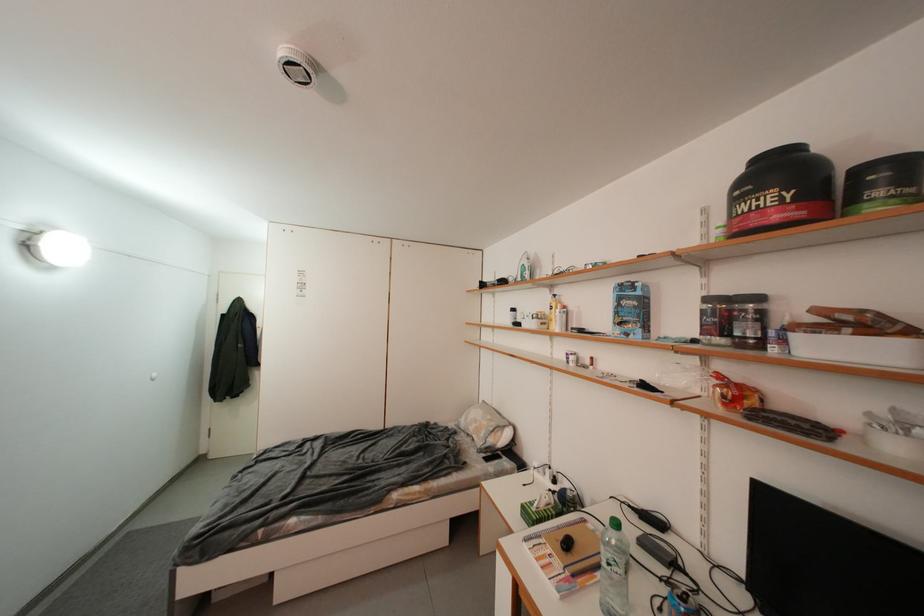
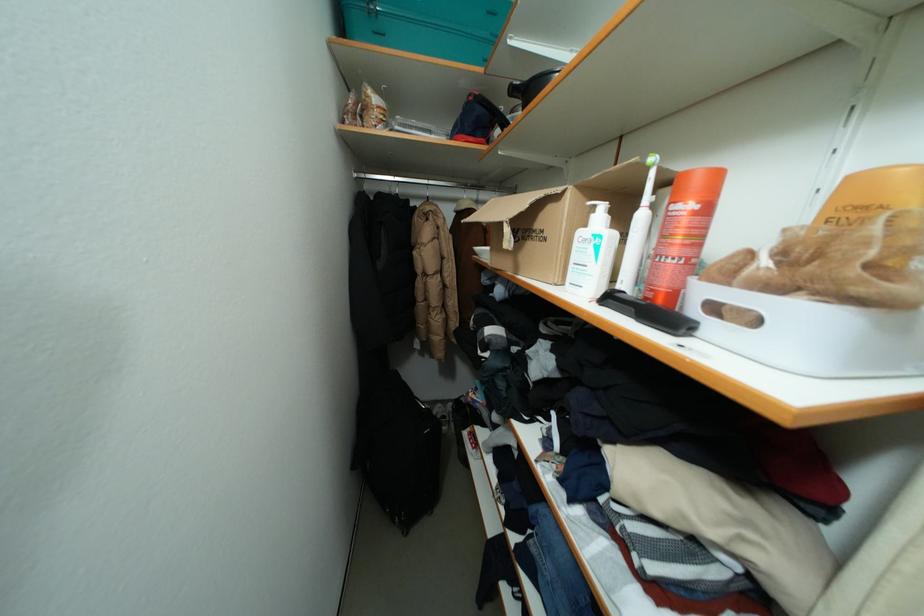
Question: I am providing you with two images of the same scene from different viewpoints. Please identify which objects are invisible in image2.

Choices:
 (A) yellow shampoo bottle
 (B) hanger hook
 (C) supplement jar lid
 (D) red house magnet

Answer: (C)